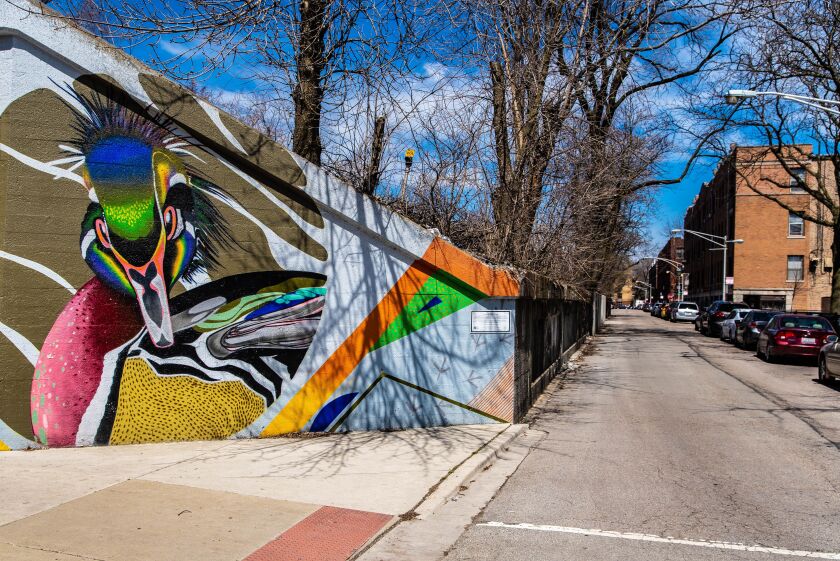
Locate an element on the screen. large wall with mural is located at coordinates (180, 266).